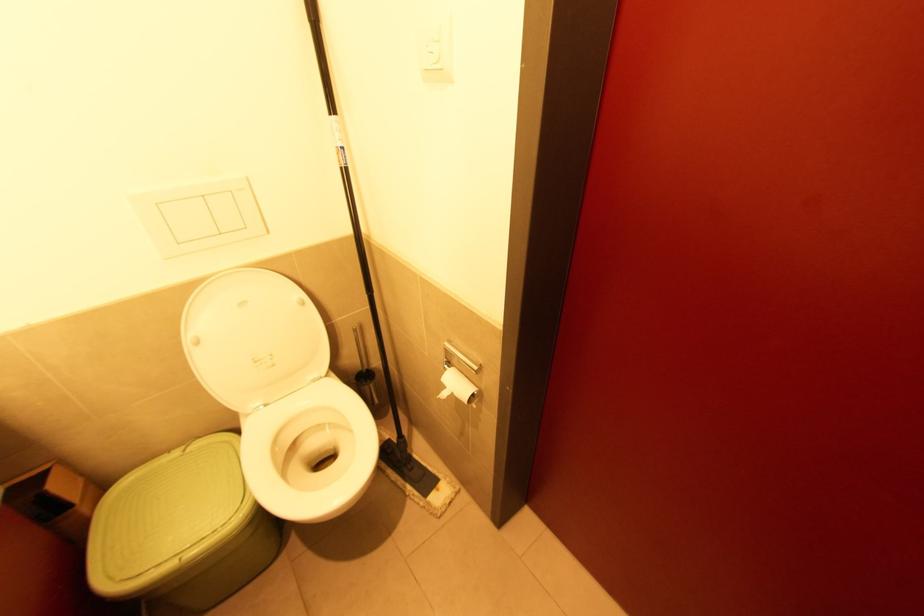
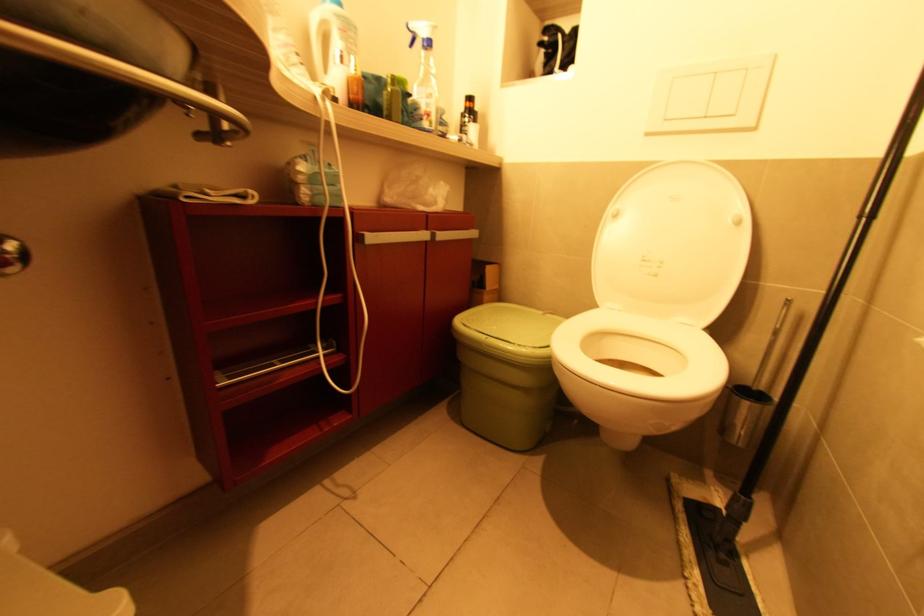
Locate, in the second image, the point that corresponds to [187,452] in the first image.

(545, 314)